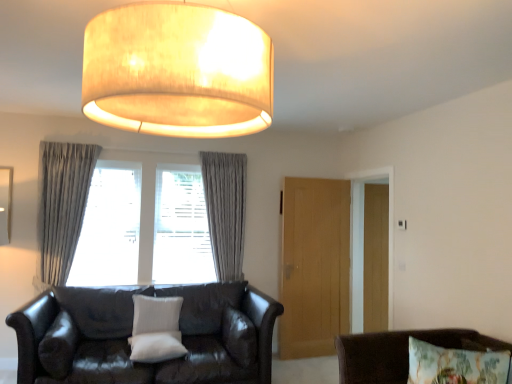
Question: From the image's perspective, is transparent wood door at right, acting as the 2th glass door starting from the front, positioned above or below light brown wooden door at center, the 2th glass door from the back?

Choices:
 (A) above
 (B) below

Answer: (A)

Question: In the image, is transparent wood door at right, which is the 2th glass door in left-to-right order, positioned in front of or behind light brown wooden door at center, acting as the first glass door starting from the left?

Choices:
 (A) front
 (B) behind

Answer: (B)

Question: Which of these objects is positioned closest to the transparent wood door at right, acting as the 2th glass door starting from the front?

Choices:
 (A) leather couch with pillows at lower left
 (B) light brown wooden door at center, the 2th glass door from the back
 (C) white textured pillow at center, the 1th pillow in the back-to-front sequence
 (D) matte beige lampshade at upper center
 (E) white soft pillow at center, the 2th pillow in the back-to-front sequence

Answer: (B)

Question: Based on their relative distances, which object is farther from the gray textured curtain at center, positioned as the first curtain in back-to-front order?

Choices:
 (A) gray textured curtains at center
 (B) gray fabric curtain at left, the 1th curtain viewed from the front
 (C) white textured pillow at center, the 1th pillow in the back-to-front sequence
 (D) white soft pillow at center, placed as the first pillow when sorted from front to back
 (E) floral fabric cushion at lower right

Answer: (E)